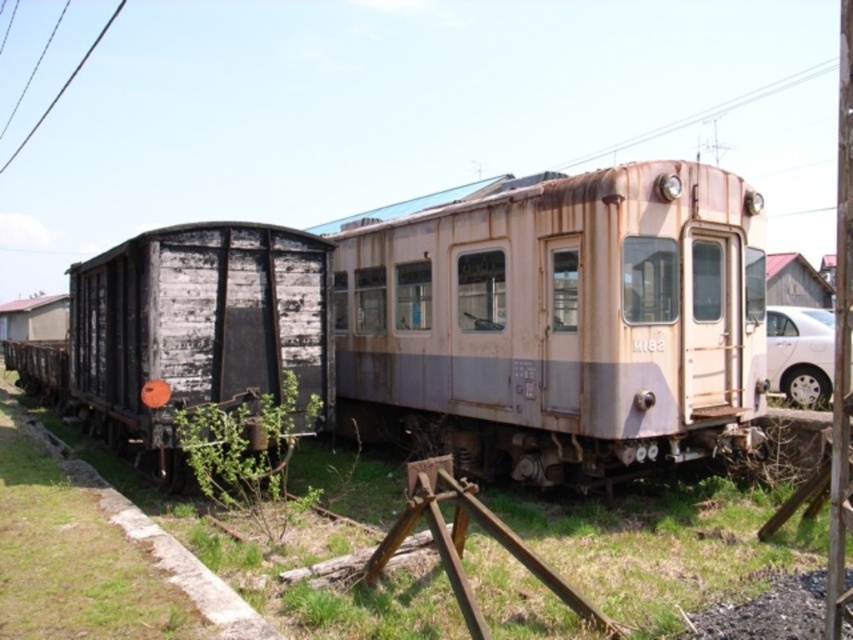
Does weathered wood wagon at left have a greater width compared to white matte car at right?

In fact, weathered wood wagon at left might be narrower than white matte car at right.

Who is shorter, weathered wood wagon at left or white matte car at right?

weathered wood wagon at left

You are a GUI agent. You are given a task and a screenshot of the screen. Output one action in this format:
    pyautogui.click(x=<x>, y=<y>)
    Task: Click on the weathered wood wagon at left
    The image size is (853, 640).
    Given the screenshot: What is the action you would take?
    pyautogui.click(x=196, y=326)

Is rusty metal train at center below black wire at upper left?

Yes, rusty metal train at center is below black wire at upper left.

Is rusty metal train at center bigger than black wire at upper left?

Indeed, rusty metal train at center has a larger size compared to black wire at upper left.

Between point (663, 179) and point (120, 8), which one is positioned in front?

Point (663, 179) is in front.

Identify the location of rusty metal train at center. The image size is (853, 640). (450, 324).

Based on the photo, does weathered wood wagon at left lie in front of black wire at upper left?

Yes, weathered wood wagon at left is closer to the viewer.

Does weathered wood wagon at left appear on the right side of black wire at upper left?

Correct, you'll find weathered wood wagon at left to the right of black wire at upper left.

This screenshot has height=640, width=853. Find the location of `weathered wood wagon at left`. weathered wood wagon at left is located at coordinates (196, 326).